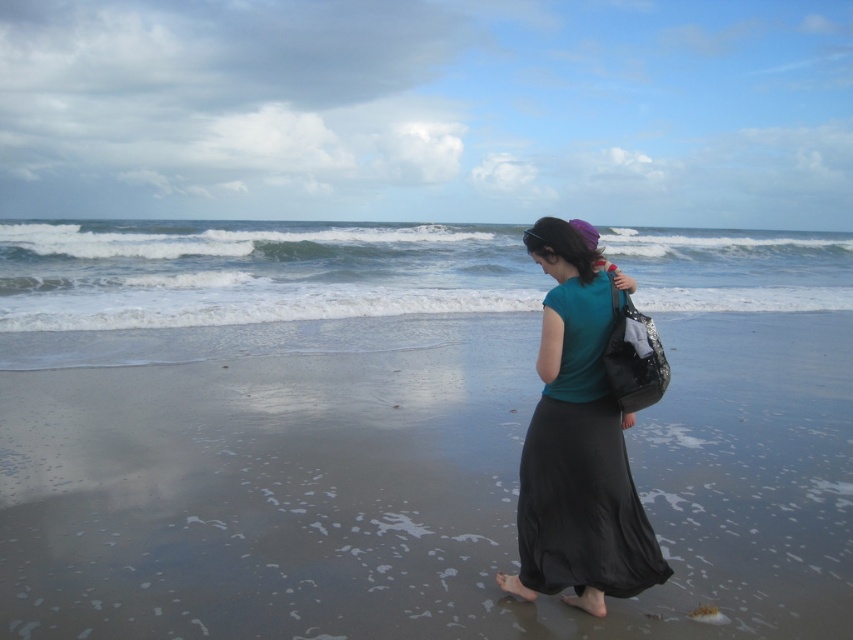
You are standing on the beach and want to walk towards the ocean. Which object would you step on first, the smooth sand at lower center or the white foamy water at center?

You would step on the smooth sand at lower center first because it is in front of the white foamy water at center, meaning it is closer to your starting position.